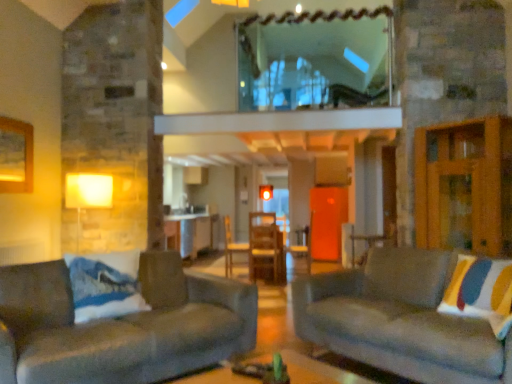
Question: From a real-world perspective, is velvet gray couch at right, placed as the 2th studio couch when sorted from left to right, above or below metallic silver table at center?

Choices:
 (A) below
 (B) above

Answer: (A)

Question: From the image's perspective, is velvet gray couch at right, placed as the 2th studio couch when sorted from left to right, positioned above or below metallic silver table at center?

Choices:
 (A) below
 (B) above

Answer: (B)

Question: Which object is positioned farthest from the wooden chair at center?

Choices:
 (A) velvet gray couch at right, the 1th studio couch viewed from the right
 (B) clear glass window at upper center
 (C) velvet gray couch at left, acting as the 2th studio couch starting from the right
 (D) matte yellow lampshade at left
 (E) striped fabric pillow at right

Answer: (E)

Question: Based on their relative distances, which object is farther from the velvet gray couch at left, acting as the 2th studio couch starting from the right?

Choices:
 (A) matte yellow lampshade at left
 (B) metallic silver table at center
 (C) clear glass window at upper center
 (D) velvet gray couch at right, placed as the 2th studio couch when sorted from left to right
 (E) wooden chair at center

Answer: (E)